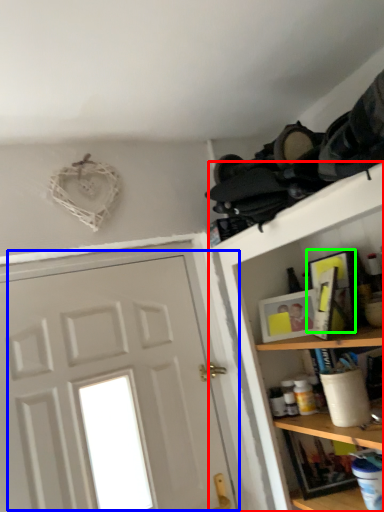
Question: Estimate the real-world distances between objects in this image. Which object is closer to shelf (highlighted by a red box), door (highlighted by a blue box) or picture frame (highlighted by a green box)?

Choices:
 (A) door
 (B) picture frame

Answer: (B)